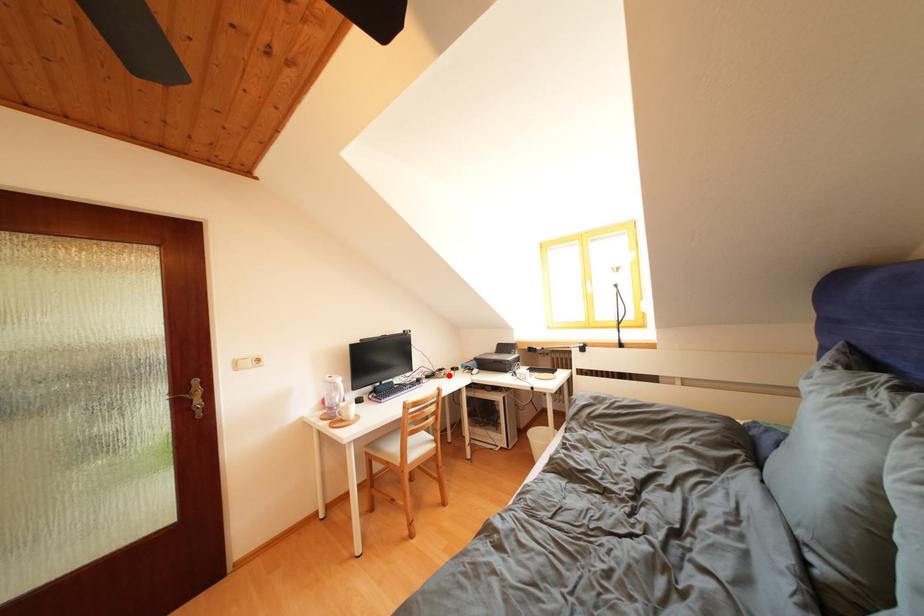
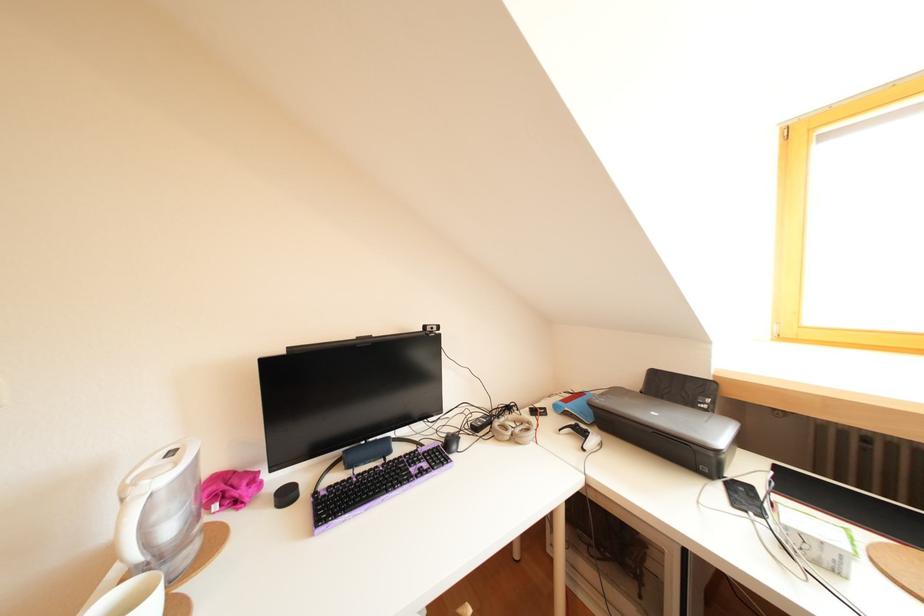
Find the pixel in the second image that matches the highlighted location in the first image.

(516, 413)